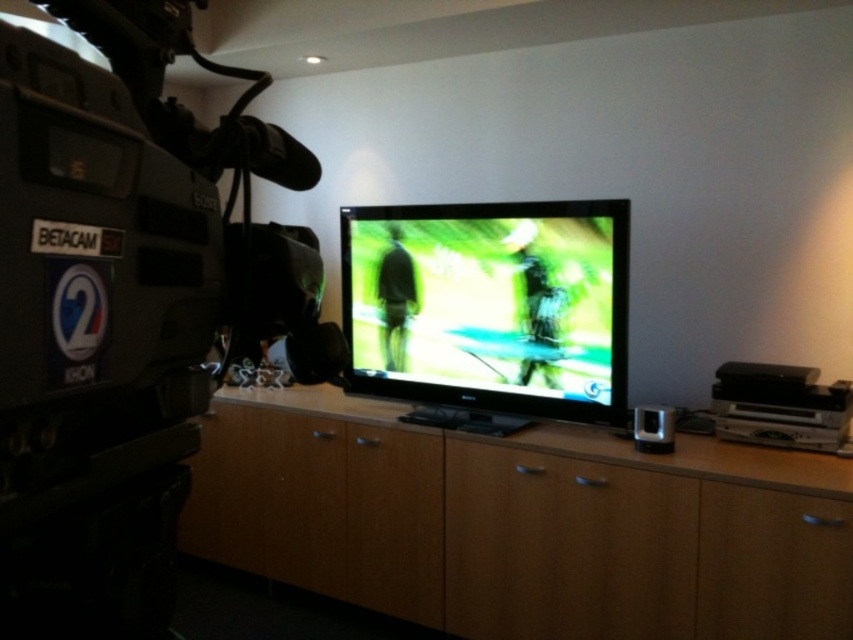
Question: Is light brown wood dresser at center wider than green matte screen at center?

Choices:
 (A) no
 (B) yes

Answer: (B)

Question: Among these objects, which one is nearest to the camera?

Choices:
 (A) green matte screen at center
 (B) light brown wood dresser at center

Answer: (B)

Question: Is light brown wood dresser at center to the left of green matte screen at center from the viewer's perspective?

Choices:
 (A) yes
 (B) no

Answer: (A)

Question: Is light brown wood dresser at center above green matte screen at center?

Choices:
 (A) yes
 (B) no

Answer: (B)

Question: Among these objects, which one is nearest to the camera?

Choices:
 (A) light brown wood dresser at center
 (B) green matte screen at center

Answer: (A)